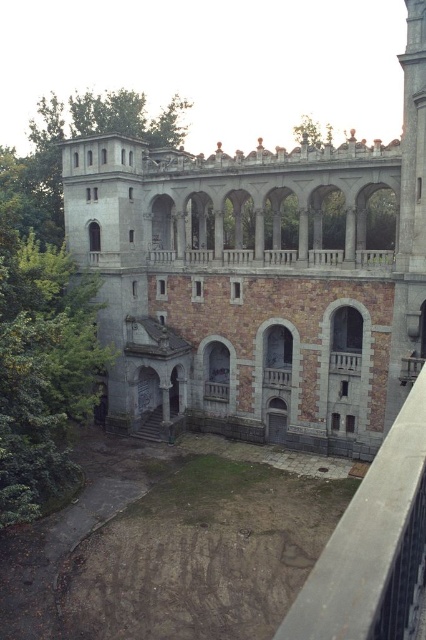
Question: Which point is farther to the camera?

Choices:
 (A) stone textured balcony at center
 (B) gray concrete rail at center
 (C) stone gray palace at center

Answer: (A)

Question: Which object is farther from the camera taking this photo?

Choices:
 (A) stone gray palace at center
 (B) stone textured balcony at center
 (C) gray concrete rail at center
 (D) smooth stone balcony at center

Answer: (D)

Question: Where is gray concrete rail at center located in relation to stone textured balcony at center in the image?

Choices:
 (A) below
 (B) above

Answer: (A)

Question: Can you confirm if stone gray palace at center is wider than stone textured balcony at center?

Choices:
 (A) yes
 (B) no

Answer: (A)

Question: Which point is closer to the camera taking this photo?

Choices:
 (A) (138, 230)
 (B) (368, 524)
 (C) (334, 369)

Answer: (B)

Question: Does stone gray palace at center appear on the right side of smooth stone balcony at center?

Choices:
 (A) no
 (B) yes

Answer: (B)